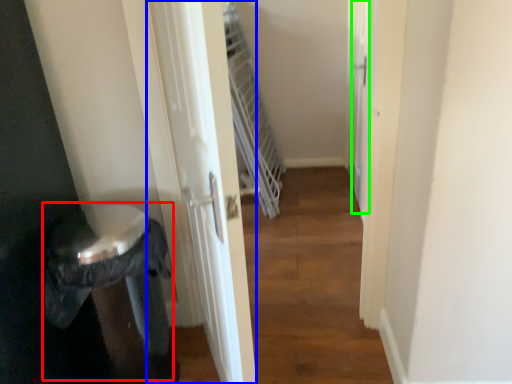
Question: Which is farther away from potty (highlighted by a red box)? screen door (highlighted by a blue box) or screen door (highlighted by a green box)?

Choices:
 (A) screen door
 (B) screen door

Answer: (B)